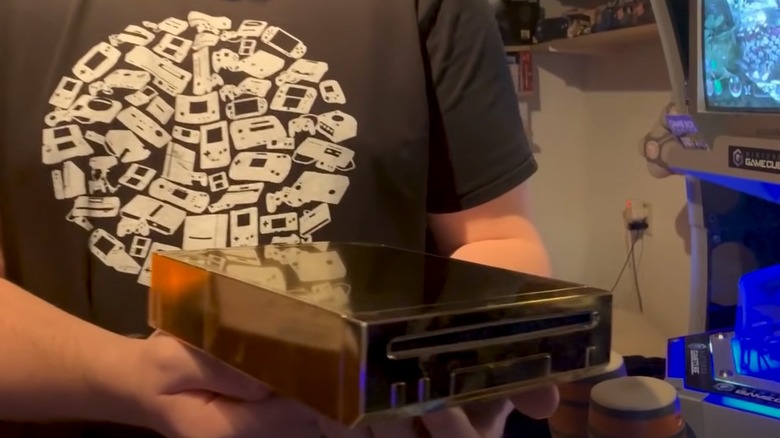
Where is `screen`? screen is located at coordinates click(x=739, y=286), click(x=743, y=63).